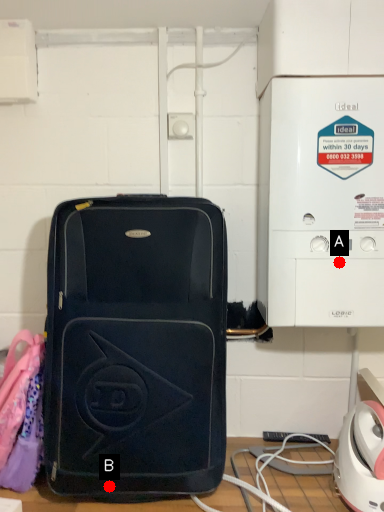
Question: Two points are circled on the image, labeled by A and B beside each circle. Which point is farther from the camera taking this photo?

Choices:
 (A) A is further
 (B) B is further

Answer: (A)